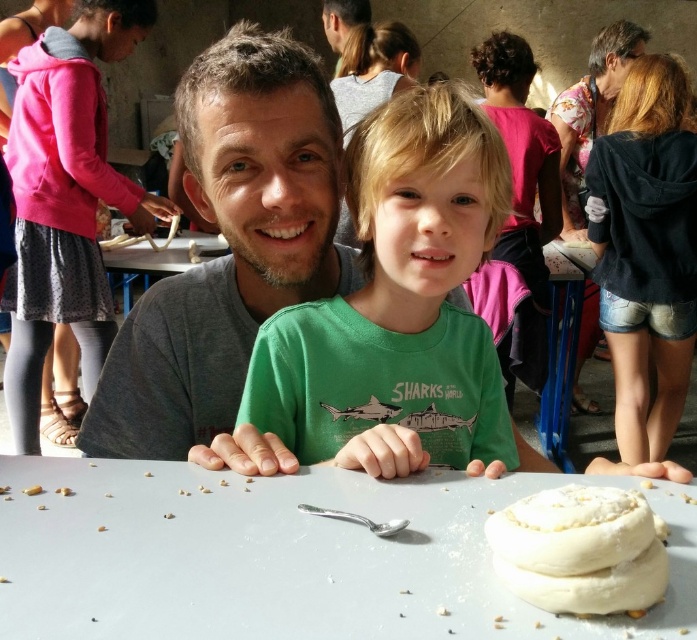
You are a chef standing at the table where the white doughnut at center is placed. You need to reach for a spoon that is 18.87 inches away from the doughnut. Is the spoon within your comfortable reach if your maximum comfortable reach is 18 inches?

The spoon is 18.87 inches away from the white doughnut at center, which is beyond your maximum comfortable reach of 18 inches. You may need to move closer or extend your reach slightly.

You are organizing a small event and need to place a 1.2 meter wide banner between the white matte table at center and the pink fabric at left. Based on the scene, can the banner fit between them?

A: The white matte table at center might be wider than the pink fabric at left, so the banner might not fit between them as the distance may be insufficient.

You are standing at the entrance of the room and want to locate the white matte table at center. According to the coordinates provided, in which direction should you move to reach it?

The white matte table at center is located at coordinates point (284, 556). Since the x coordinate is 0.869, which is closer to the right edge of the image, you should move to the right to reach it.